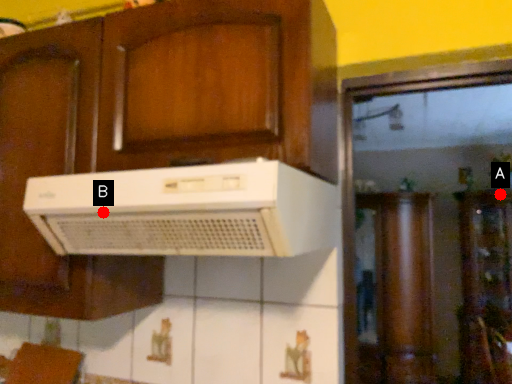
Question: Two points are circled on the image, labeled by A and B beside each circle. Which point is further to the camera?

Choices:
 (A) A is further
 (B) B is further

Answer: (A)